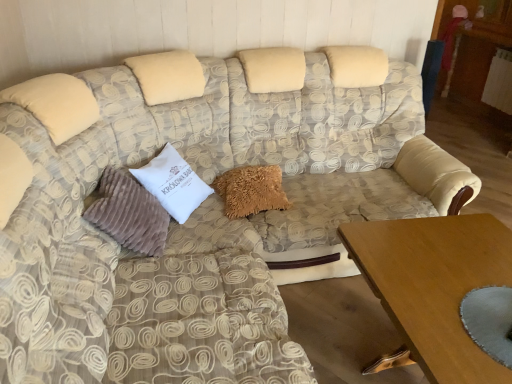
What do you see at coordinates (129, 213) in the screenshot? I see `suede-like beige pillow at left, acting as the 3th pillow starting from the right` at bounding box center [129, 213].

What do you see at coordinates (251, 190) in the screenshot?
I see `fuzzy beige pillow at center, which appears as the 3th pillow when viewed from the left` at bounding box center [251, 190].

The width and height of the screenshot is (512, 384). What do you see at coordinates (434, 284) in the screenshot? I see `wooden table at lower right` at bounding box center [434, 284].

Identify the location of suede-like beige pillow at left, acting as the 3th pillow starting from the right. This screenshot has height=384, width=512. (129, 213).

How much distance is there between wooden table at lower right and fuzzy beige pillow at center, which appears as the 3th pillow when viewed from the left?

wooden table at lower right is 81.02 centimeters from fuzzy beige pillow at center, which appears as the 3th pillow when viewed from the left.

Is wooden table at lower right turned away from fuzzy beige pillow at center, the first pillow positioned from the right?

That's not correct — wooden table at lower right is not looking away from fuzzy beige pillow at center, the first pillow positioned from the right.

Does point (483, 271) come in front of point (262, 186)?

That is True.

Considering the sizes of objects wooden table at lower right and fuzzy beige pillow at center, which appears as the 3th pillow when viewed from the left, in the image provided, who is thinner, wooden table at lower right or fuzzy beige pillow at center, which appears as the 3th pillow when viewed from the left,?

fuzzy beige pillow at center, which appears as the 3th pillow when viewed from the left, is thinner.

Is white velvety pillow at center, the 2th pillow in the right-to-left sequence, surrounded by wooden table at lower right?

No, wooden table at lower right does not contain white velvety pillow at center, the 2th pillow in the right-to-left sequence.

Is the surface of wooden table at lower right in direct contact with white velvety pillow at center, which is counted as the second pillow, starting from the left?

No, wooden table at lower right is not with white velvety pillow at center, which is counted as the second pillow, starting from the left.

What's the angular difference between wooden table at lower right and white velvety pillow at center, the 2th pillow in the right-to-left sequence,'s facing directions?

The angular difference between wooden table at lower right and white velvety pillow at center, the 2th pillow in the right-to-left sequence, is 34.9 degrees.

Who is smaller, wooden table at lower right or white velvety pillow at center, which is counted as the second pillow, starting from the left?

white velvety pillow at center, which is counted as the second pillow, starting from the left, is smaller.

Is fuzzy beige pillow at center, which appears as the 3th pillow when viewed from the left, surrounding suede-like beige pillow at left, acting as the 3th pillow starting from the right?

That's incorrect, suede-like beige pillow at left, acting as the 3th pillow starting from the right, is not inside fuzzy beige pillow at center, which appears as the 3th pillow when viewed from the left.

Looking at this image, from the image's perspective, is fuzzy beige pillow at center, which appears as the 3th pillow when viewed from the left, under suede-like beige pillow at left, acting as the 3th pillow starting from the right?

Actually, fuzzy beige pillow at center, which appears as the 3th pillow when viewed from the left, appears above suede-like beige pillow at left, acting as the 3th pillow starting from the right, in the image.

Between fuzzy beige pillow at center, the first pillow positioned from the right, and suede-like beige pillow at left, acting as the 3th pillow starting from the right, which one has less height?

fuzzy beige pillow at center, the first pillow positioned from the right.

Which is further, (169,186) or (281,184)?

Positioned behind is point (281,184).

Considering the relative positions of white velvety pillow at center, the 2th pillow in the right-to-left sequence, and fuzzy beige pillow at center, the first pillow positioned from the right, in the image provided, is white velvety pillow at center, the 2th pillow in the right-to-left sequence, behind fuzzy beige pillow at center, the first pillow positioned from the right,?

No.

Image resolution: width=512 pixels, height=384 pixels. I want to click on the 1st pillow below the white velvety pillow at center, the 2th pillow in the right-to-left sequence (from the image's perspective), so click(x=251, y=190).

Does white velvety pillow at center, which is counted as the second pillow, starting from the left, have a greater width compared to fuzzy beige pillow at center, which appears as the 3th pillow when viewed from the left?

Incorrect, the width of white velvety pillow at center, which is counted as the second pillow, starting from the left, does not surpass that of fuzzy beige pillow at center, which appears as the 3th pillow when viewed from the left.

Considering the sizes of objects suede-like beige pillow at left, the 1th pillow from the left, and fuzzy beige pillow at center, which appears as the 3th pillow when viewed from the left, in the image provided, who is taller, suede-like beige pillow at left, the 1th pillow from the left, or fuzzy beige pillow at center, which appears as the 3th pillow when viewed from the left,?

suede-like beige pillow at left, the 1th pillow from the left, is taller.

From the image's perspective, which one is positioned higher, suede-like beige pillow at left, the 1th pillow from the left, or fuzzy beige pillow at center, which appears as the 3th pillow when viewed from the left?

From the image's view, fuzzy beige pillow at center, which appears as the 3th pillow when viewed from the left, is above.

Is suede-like beige pillow at left, acting as the 3th pillow starting from the right, aimed at fuzzy beige pillow at center, the first pillow positioned from the right?

Yes, suede-like beige pillow at left, acting as the 3th pillow starting from the right, is aimed at fuzzy beige pillow at center, the first pillow positioned from the right.

Between suede-like beige pillow at left, the 1th pillow from the left, and fuzzy beige pillow at center, which appears as the 3th pillow when viewed from the left, which one appears on the left side from the viewer's perspective?

suede-like beige pillow at left, the 1th pillow from the left.

Between fuzzy beige pillow at center, the first pillow positioned from the right, and white velvety pillow at center, the 2th pillow in the right-to-left sequence, which one is positioned in front?

white velvety pillow at center, the 2th pillow in the right-to-left sequence, is closer to the camera.

From a real-world perspective, is fuzzy beige pillow at center, the first pillow positioned from the right, positioned above or below white velvety pillow at center, the 2th pillow in the right-to-left sequence?

Clearly, from a real-world perspective, fuzzy beige pillow at center, the first pillow positioned from the right, is below white velvety pillow at center, the 2th pillow in the right-to-left sequence.

Is point (234, 190) closer to camera compared to point (170, 201)?

No, (234, 190) is further to viewer.

Considering the sizes of objects fuzzy beige pillow at center, which appears as the 3th pillow when viewed from the left, and white velvety pillow at center, the 2th pillow in the right-to-left sequence, in the image provided, who is shorter, fuzzy beige pillow at center, which appears as the 3th pillow when viewed from the left, or white velvety pillow at center, the 2th pillow in the right-to-left sequence,?

fuzzy beige pillow at center, which appears as the 3th pillow when viewed from the left, is shorter.

Is wooden table at lower right at the back of white velvety pillow at center, the 2th pillow in the right-to-left sequence?

white velvety pillow at center, the 2th pillow in the right-to-left sequence, does not have its back to wooden table at lower right.

Is point (175, 187) positioned after point (445, 293)?

That is True.

In the scene shown: Considering the relative positions of white velvety pillow at center, the 2th pillow in the right-to-left sequence, and wooden table at lower right in the image provided, is white velvety pillow at center, the 2th pillow in the right-to-left sequence, to the left or to the right of wooden table at lower right?

white velvety pillow at center, the 2th pillow in the right-to-left sequence, is positioned on wooden table at lower right's left side.

Where is `the 1st pillow directly above the wooden table at lower right (from a real-world perspective)`? the 1st pillow directly above the wooden table at lower right (from a real-world perspective) is located at coordinates (251, 190).

Starting from the wooden table at lower right, which pillow is the 2nd one behind? Please provide its 2D coordinates.

[(173, 183)]

Looking at the image, which one is located closer to fuzzy beige pillow at center, which appears as the 3th pillow when viewed from the left, wooden table at lower right or white velvety pillow at center, which is counted as the second pillow, starting from the left?

Based on the image, white velvety pillow at center, which is counted as the second pillow, starting from the left, appears to be nearer to fuzzy beige pillow at center, which appears as the 3th pillow when viewed from the left.

Looking at the image, which one is located closer to white velvety pillow at center, which is counted as the second pillow, starting from the left, wooden table at lower right or suede-like beige pillow at left, acting as the 3th pillow starting from the right?

Among the two, suede-like beige pillow at left, acting as the 3th pillow starting from the right, is located nearer to white velvety pillow at center, which is counted as the second pillow, starting from the left.

Considering their positions, is white velvety pillow at center, which is counted as the second pillow, starting from the left, positioned closer to wooden table at lower right than suede-like beige pillow at left, the 1th pillow from the left?

suede-like beige pillow at left, the 1th pillow from the left.

Consider the image. Looking at the image, which one is located further to suede-like beige pillow at left, the 1th pillow from the left, wooden table at lower right or white velvety pillow at center, the 2th pillow in the right-to-left sequence?

wooden table at lower right is positioned further to the anchor suede-like beige pillow at left, the 1th pillow from the left.

From the picture: Estimate the real-world distances between objects in this image. Which object is closer to white velvety pillow at center, which is counted as the second pillow, starting from the left, wooden table at lower right or fuzzy beige pillow at center, which appears as the 3th pillow when viewed from the left?

fuzzy beige pillow at center, which appears as the 3th pillow when viewed from the left, is positioned closer to the anchor white velvety pillow at center, which is counted as the second pillow, starting from the left.

Based on their spatial positions, is white velvety pillow at center, which is counted as the second pillow, starting from the left, or fuzzy beige pillow at center, the first pillow positioned from the right, closer to wooden table at lower right?

The object closer to wooden table at lower right is fuzzy beige pillow at center, the first pillow positioned from the right.

When comparing their distances from white velvety pillow at center, which is counted as the second pillow, starting from the left, does fuzzy beige pillow at center, which appears as the 3th pillow when viewed from the left, or wooden table at lower right seem closer?

fuzzy beige pillow at center, which appears as the 3th pillow when viewed from the left, is positioned closer to the anchor white velvety pillow at center, which is counted as the second pillow, starting from the left.

From the image, which object appears to be nearer to wooden table at lower right, fuzzy beige pillow at center, which appears as the 3th pillow when viewed from the left, or suede-like beige pillow at left, the 1th pillow from the left?

fuzzy beige pillow at center, which appears as the 3th pillow when viewed from the left, is closer to wooden table at lower right.

Where is `pillow located between white velvety pillow at center, which is counted as the second pillow, starting from the left, and wooden table at lower right in the left-right direction`? The height and width of the screenshot is (384, 512). pillow located between white velvety pillow at center, which is counted as the second pillow, starting from the left, and wooden table at lower right in the left-right direction is located at coordinates (251, 190).

Locate an element on the screen. The height and width of the screenshot is (384, 512). pillow between suede-like beige pillow at left, acting as the 3th pillow starting from the right, and fuzzy beige pillow at center, which appears as the 3th pillow when viewed from the left is located at coordinates (173, 183).